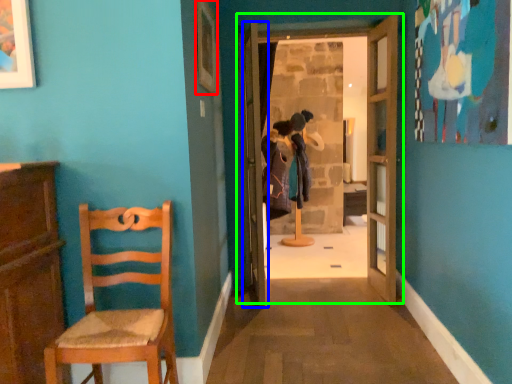
Question: Which is farther away from picture frame (highlighted by a red box)? door (highlighted by a blue box) or door (highlighted by a green box)?

Choices:
 (A) door
 (B) door

Answer: (A)